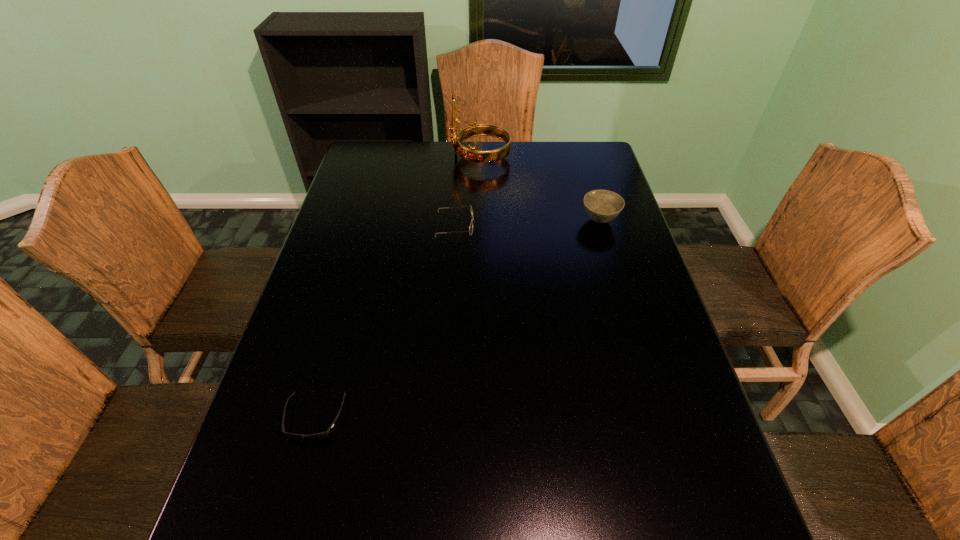
Find the location of a particular element. The image size is (960, 540). free spot located 0.120m on the left of the third shortest object is located at coordinates (540, 220).

You are a GUI agent. You are given a task and a screenshot of the screen. Output one action in this format:
    pyautogui.click(x=<x>, y=<y>)
    Task: Click on the free space located on the front-facing side of the spectacles
    The image size is (960, 540).
    Given the screenshot: What is the action you would take?
    pyautogui.click(x=560, y=225)

Identify the location of free spot located on the front-facing side of the shortest object. (290, 508).

Locate an element on the screen. This screenshot has width=960, height=540. object present at the far edge is located at coordinates (473, 130).

Identify the location of object that is at the left edge. (324, 434).

Where is `object present at the right edge`? This screenshot has height=540, width=960. object present at the right edge is located at coordinates (602, 206).

The image size is (960, 540). What are the coordinates of `free region at the far edge` in the screenshot? It's located at (399, 173).

In the image, there is a desktop. Identify the location of blank space at the left edge. The height and width of the screenshot is (540, 960). (300, 386).

This screenshot has width=960, height=540. Identify the location of free spot at the right edge of the desktop. (619, 367).

In the image, there is a desktop. At what (x,y) coordinates should I click in order to perform the action: click on free space at the far left corner. Please return your answer as a coordinate pair (x, y). Image resolution: width=960 pixels, height=540 pixels. Looking at the image, I should click on pos(386,153).